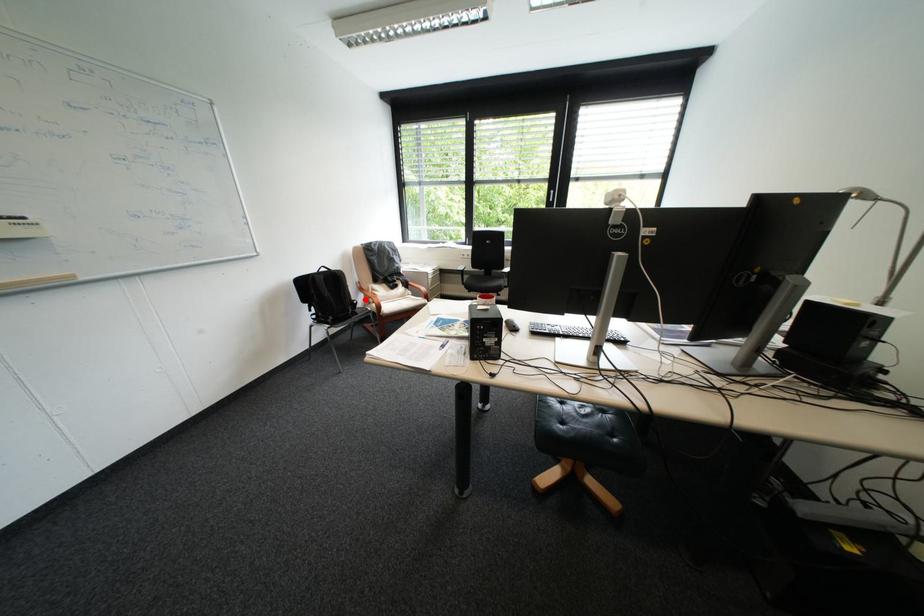
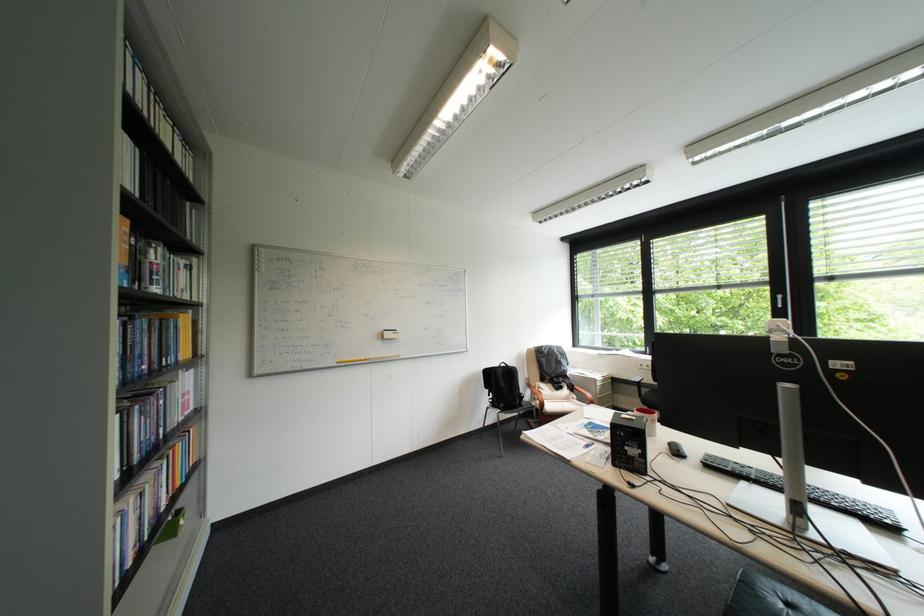
Question: A red point is marked in image1. In image2, is the corresponding 3D point closer to the camera or farther? Reply with the corresponding letter.

Choices:
 (A) The corresponding 3D point is closer.
 (B) The corresponding 3D point is farther.

Answer: (B)